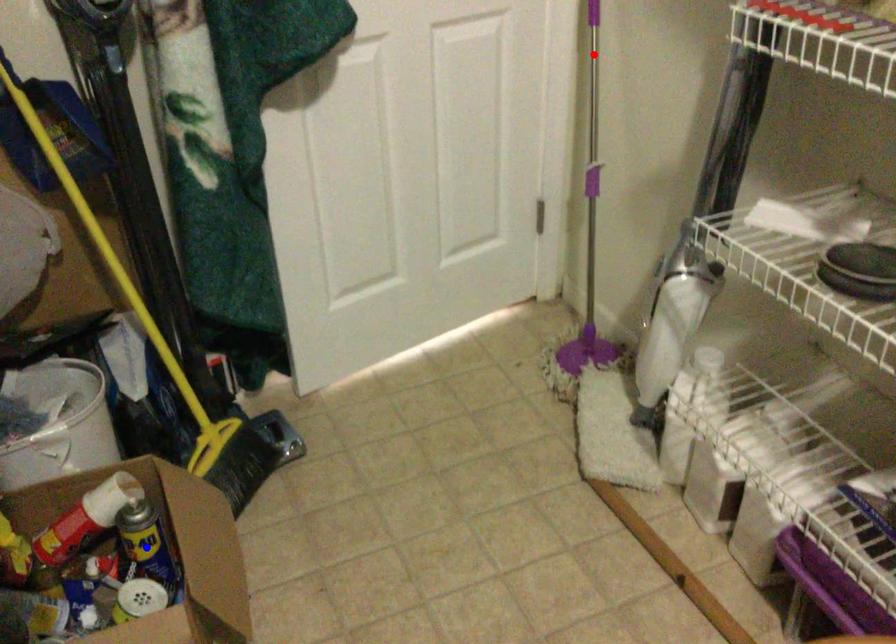
Question: Two points are marked on the image. Which point is closer to the camera?

Choices:
 (A) Blue point is closer.
 (B) Red point is closer.

Answer: (A)